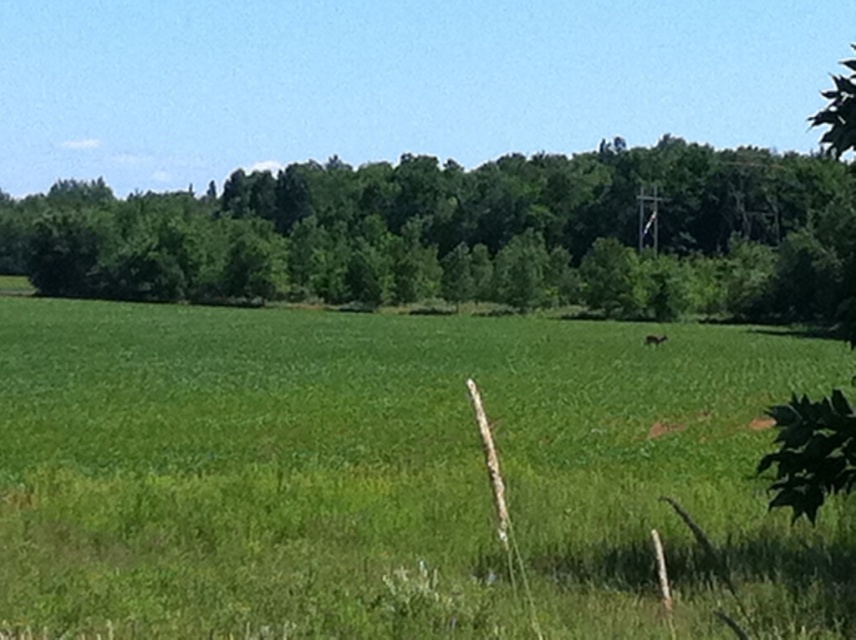
Question: Which object appears closest to the camera in this image?

Choices:
 (A) brown furry deer at center
 (B) green grass pasture at center

Answer: (B)

Question: Is green leafy tree at center further to the viewer compared to brown furry deer at center?

Choices:
 (A) no
 (B) yes

Answer: (A)

Question: Can you confirm if green grass pasture at center is bigger than brown furry deer at center?

Choices:
 (A) yes
 (B) no

Answer: (A)

Question: Which point is closer to the camera taking this photo?

Choices:
 (A) (179, 444)
 (B) (269, 177)

Answer: (A)

Question: Does green grass pasture at center have a greater width compared to green leafy tree at center?

Choices:
 (A) yes
 (B) no

Answer: (B)

Question: Which point appears farthest from the camera in this image?

Choices:
 (A) (176, 497)
 (B) (589, 291)

Answer: (B)